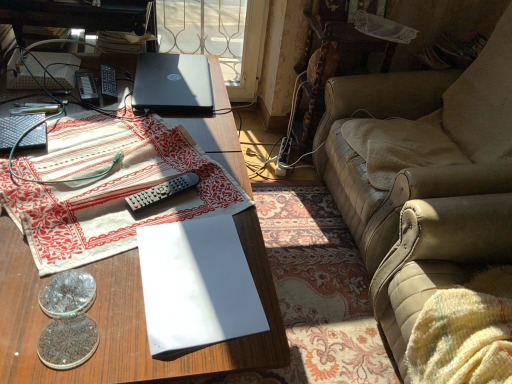
Image resolution: width=512 pixels, height=384 pixels. Identify the location of free space in front of satin black laptop at upper center. (147, 131).